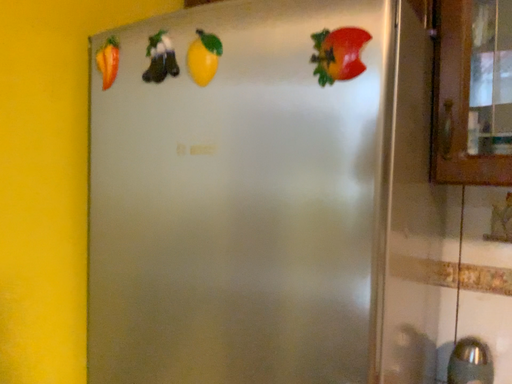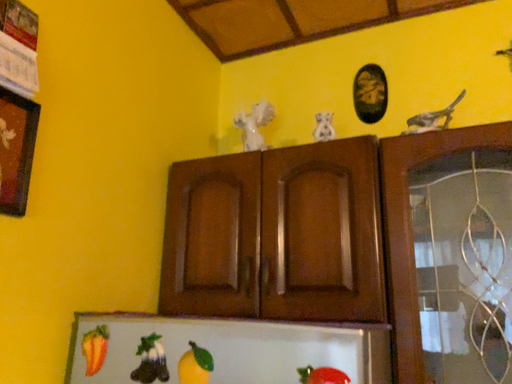
Question: Which way did the camera rotate in the video?

Choices:
 (A) rotated left
 (B) rotated right

Answer: (B)